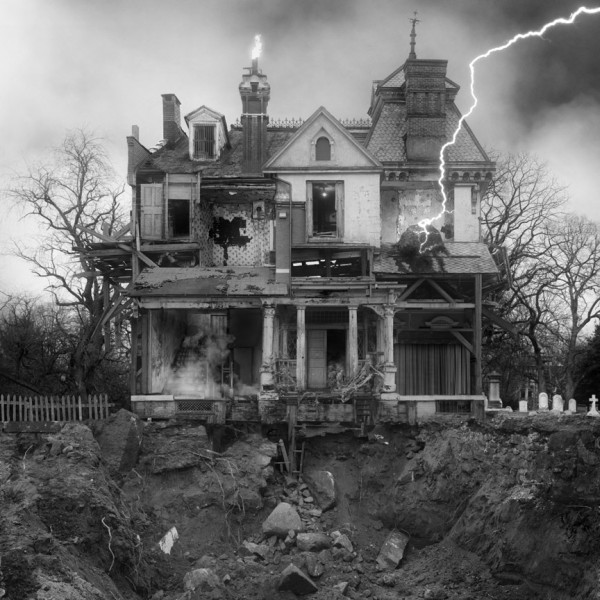
Where is `chimney`? This screenshot has width=600, height=600. chimney is located at coordinates (170, 107).